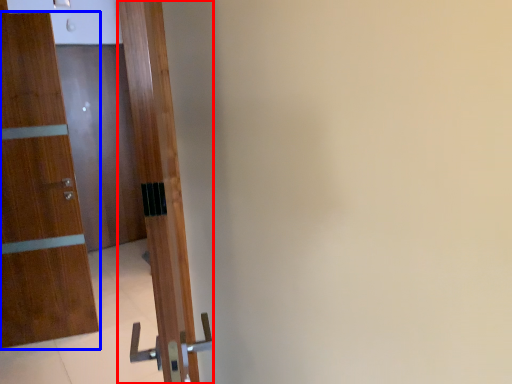
Question: Which object appears closest to the camera in this image, door (highlighted by a red box) or door (highlighted by a blue box)?

Choices:
 (A) door
 (B) door

Answer: (A)